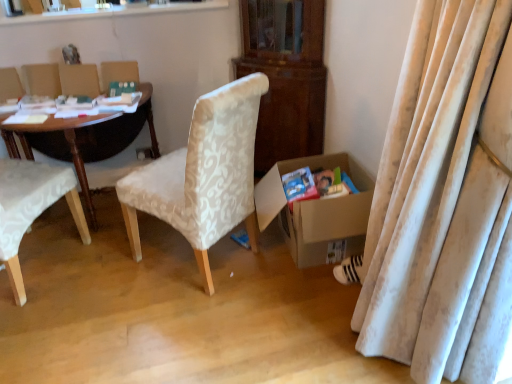
Describe the element at coordinates (348, 270) in the screenshot. I see `white striped fabric sneakers at lower right` at that location.

The image size is (512, 384). I want to click on white fabric chair at left, the 2th chair viewed from the right, so click(31, 208).

What is the approximate width of white fabric chair at left, which ranks as the 1th chair in left-to-right order?

It is 26.05 inches.

What do you see at coordinates (317, 184) in the screenshot? I see `matte cardboard magazine at lower right` at bounding box center [317, 184].

Measure the distance between point (328, 175) and camera.

The distance of point (328, 175) from camera is 7.43 feet.

Identify the location of green matte paperback book at upper left, placed as the 2th paperback book when sorted from right to left. (121, 88).

What do you see at coordinates (203, 174) in the screenshot?
I see `white textured fabric chair at center, which is the second chair in left-to-right order` at bounding box center [203, 174].

Find the location of a particular element. The image size is (512, 384). cardboard box at lower right is located at coordinates (317, 212).

Based on the photo, how different are the orientations of cardboard box at lower right and green matte paperback book at upper left, marked as the first paperback book in a left-to-right arrangement, in degrees?

The facing directions of cardboard box at lower right and green matte paperback book at upper left, marked as the first paperback book in a left-to-right arrangement, are 74.4 degrees apart.

From the image's perspective, would you say cardboard box at lower right is shown under green matte paperback book at upper left, which is the 2th paperback book in bottom-to-top order?

Yes, from the image's perspective, cardboard box at lower right is below green matte paperback book at upper left, which is the 2th paperback book in bottom-to-top order.

From a real-world perspective, is cardboard box at lower right located beneath green matte paperback book at upper left, marked as the first paperback book in a left-to-right arrangement?

Indeed, from a real-world perspective, cardboard box at lower right is positioned beneath green matte paperback book at upper left, marked as the first paperback book in a left-to-right arrangement.

How much distance is there between cardboard box at lower right and green matte paperback book at upper left, the second paperback book viewed from the front?

The distance of cardboard box at lower right from green matte paperback book at upper left, the second paperback book viewed from the front, is 3.84 feet.

Is white fabric chair at left, the 2th chair viewed from the right, oriented away from white striped fabric sneakers at lower right?

No, white fabric chair at left, the 2th chair viewed from the right, is not facing the opposite direction of white striped fabric sneakers at lower right.

Are white fabric chair at left, the 2th chair viewed from the right, and white striped fabric sneakers at lower right beside each other?

white fabric chair at left, the 2th chair viewed from the right, is not next to white striped fabric sneakers at lower right, and they're not touching.

Does white fabric chair at left, which ranks as the 1th chair in left-to-right order, have a smaller size compared to white striped fabric sneakers at lower right?

Actually, white fabric chair at left, which ranks as the 1th chair in left-to-right order, might be larger than white striped fabric sneakers at lower right.

Can you tell me how much white fabric chair at left, the 2th chair viewed from the right, and white striped fabric sneakers at lower right differ in facing direction?

The facing directions of white fabric chair at left, the 2th chair viewed from the right, and white striped fabric sneakers at lower right are 121 degrees apart.

Based on the photo, considering the relative positions of cardboard box at lower right and wooden polished desk at left in the image provided, is cardboard box at lower right to the right of wooden polished desk at left from the viewer's perspective?

Indeed, cardboard box at lower right is positioned on the right side of wooden polished desk at left.

From a real-world perspective, is cardboard box at lower right positioned above or below wooden polished desk at left?

From a real-world perspective, cardboard box at lower right is physically below wooden polished desk at left.

Is cardboard box at lower right shorter than wooden polished desk at left?

Correct, cardboard box at lower right is not as tall as wooden polished desk at left.

Would you consider cardboard box at lower right to be distant from wooden polished desk at left?

Absolutely, cardboard box at lower right is distant from wooden polished desk at left.

From the image's perspective, is white striped fabric sneakers at lower right above or below wooden polished desk at left?

Clearly, from the image's perspective, white striped fabric sneakers at lower right is below wooden polished desk at left.

From a real-world perspective, is white striped fabric sneakers at lower right positioned above or below wooden polished desk at left?

Clearly, from a real-world perspective, white striped fabric sneakers at lower right is below wooden polished desk at left.

Is white striped fabric sneakers at lower right behind wooden polished desk at left?

Yes, white striped fabric sneakers at lower right is further from the camera.

In terms of width, does white striped fabric sneakers at lower right look wider or thinner when compared to wooden polished desk at left?

white striped fabric sneakers at lower right is thinner than wooden polished desk at left.

Looking at this image, based on their sizes in the image, would you say white textured fabric chair at center, which is the second chair in left-to-right order, is bigger or smaller than green matte paperback book at upper left, marked as the first paperback book in a left-to-right arrangement?

Clearly, white textured fabric chair at center, which is the second chair in left-to-right order, is larger in size than green matte paperback book at upper left, marked as the first paperback book in a left-to-right arrangement.

Locate an element on the screen. The image size is (512, 384). chair that is the 1st one when counting forward from the green matte paperback book at upper left, the first paperback book from the back is located at coordinates (203, 174).

Is white textured fabric chair at center, the 1th chair in the right-to-left sequence, to the right of green matte paperback book at upper left, positioned as the first paperback book in top-to-bottom order, from the viewer's perspective?

Correct, you'll find white textured fabric chair at center, the 1th chair in the right-to-left sequence, to the right of green matte paperback book at upper left, positioned as the first paperback book in top-to-bottom order.

Between white textured fabric chair at center, the 1th chair in the right-to-left sequence, and green matte paperback book at upper left, the second paperback book viewed from the front, which one has more height?

Standing taller between the two is white textured fabric chair at center, the 1th chair in the right-to-left sequence.

Between green matte paperback book at upper left, positioned as the first paperback book in top-to-bottom order, and white fabric chair at left, which ranks as the 1th chair in left-to-right order, which one has smaller width?

green matte paperback book at upper left, positioned as the first paperback book in top-to-bottom order, is thinner.

I want to click on paperback book that is the 1st object to the right of the white fabric chair at left, which ranks as the 1th chair in left-to-right order, starting at the anchor, so click(121, 88).

Is green matte paperback book at upper left, the first paperback book from the back, taller than white fabric chair at left, which ranks as the 1th chair in left-to-right order?

No.

From the picture: Is white textured fabric chair at center, the 1th chair in the right-to-left sequence, looking in the opposite direction of cardboard box at lower right?

No, white textured fabric chair at center, the 1th chair in the right-to-left sequence, is not facing the opposite direction of cardboard box at lower right.

Which is behind, white textured fabric chair at center, the 1th chair in the right-to-left sequence, or cardboard box at lower right?

cardboard box at lower right.

Based on the photo, which object is positioned more to the left, white textured fabric chair at center, the 1th chair in the right-to-left sequence, or cardboard box at lower right?

From the viewer's perspective, white textured fabric chair at center, the 1th chair in the right-to-left sequence, appears more on the left side.

Consider the image. Is white textured fabric chair at center, which is the second chair in left-to-right order, located outside cardboard box at lower right?

Yes.

Locate an element on the screen. This screenshot has width=512, height=384. box below the green matte paperback book at upper left, placed as the 2th paperback book when sorted from right to left (from a real-world perspective) is located at coordinates (317, 212).

Where is `the 1st chair positioned above the white striped fabric sneakers at lower right (from the image's perspective)`? The width and height of the screenshot is (512, 384). the 1st chair positioned above the white striped fabric sneakers at lower right (from the image's perspective) is located at coordinates (31, 208).

Looking at the image, which one is located further to matte cardboard magazine at lower right, green matte paperback book at upper left, marked as the first paperback book in a left-to-right arrangement, or matte blue paperback book at lower right, positioned as the 1th paperback book in front-to-back order?

Among the two, green matte paperback book at upper left, marked as the first paperback book in a left-to-right arrangement, is located further to matte cardboard magazine at lower right.

Estimate the real-world distances between objects in this image. Which object is further from green matte paperback book at upper left, the first paperback book from the back, matte blue paperback book at lower right, the first paperback book in the bottom-to-top sequence, or white fabric chair at left, which ranks as the 1th chair in left-to-right order?

Among the two, matte blue paperback book at lower right, the first paperback book in the bottom-to-top sequence, is located further to green matte paperback book at upper left, the first paperback book from the back.

In the scene shown: From the image, which object appears to be farther from white striped fabric sneakers at lower right, white fabric chair at left, which ranks as the 1th chair in left-to-right order, or green matte paperback book at upper left, the first paperback book from the back?

white fabric chair at left, which ranks as the 1th chair in left-to-right order, lies further to white striped fabric sneakers at lower right than the other object.

Which object lies further to the anchor point matte cardboard magazine at lower right, white fabric chair at left, which ranks as the 1th chair in left-to-right order, or wooden polished desk at left?

wooden polished desk at left is positioned further to the anchor matte cardboard magazine at lower right.

When comparing their distances from white textured fabric chair at center, which is the second chair in left-to-right order, does white fabric chair at left, the 2th chair viewed from the right, or matte cardboard magazine at lower right seem closer?

matte cardboard magazine at lower right is positioned closer to the anchor white textured fabric chair at center, which is the second chair in left-to-right order.

Which object lies further to the anchor point white striped fabric sneakers at lower right, wooden polished desk at left or white textured fabric chair at center, which is the second chair in left-to-right order?

wooden polished desk at left lies further to white striped fabric sneakers at lower right than the other object.

Which object lies further to the anchor point green matte paperback book at upper left, the second paperback book viewed from the front, matte cardboard magazine at lower right or white striped fabric sneakers at lower right?

Among the two, white striped fabric sneakers at lower right is located further to green matte paperback book at upper left, the second paperback book viewed from the front.

From the image, which object appears to be farther from white textured fabric chair at center, the 1th chair in the right-to-left sequence, cardboard box at lower right or white striped fabric sneakers at lower right?

The object further to white textured fabric chair at center, the 1th chair in the right-to-left sequence, is white striped fabric sneakers at lower right.

Where is `box located between green matte paperback book at upper left, marked as the first paperback book in a left-to-right arrangement, and white striped fabric sneakers at lower right in the left-right direction`? The height and width of the screenshot is (384, 512). box located between green matte paperback book at upper left, marked as the first paperback book in a left-to-right arrangement, and white striped fabric sneakers at lower right in the left-right direction is located at coordinates (317, 212).

Locate an element on the screen. Image resolution: width=512 pixels, height=384 pixels. desk situated between white fabric chair at left, the 2th chair viewed from the right, and white striped fabric sneakers at lower right from left to right is located at coordinates (74, 144).

Locate an element on the screen. The height and width of the screenshot is (384, 512). chair situated between white fabric chair at left, the 2th chair viewed from the right, and matte cardboard magazine at lower right from left to right is located at coordinates (203, 174).

You are a GUI agent. You are given a task and a screenshot of the screen. Output one action in this format:
    pyautogui.click(x=<x>, y=<y>)
    Task: Click on the paperback book situated between green matte paperback book at upper left, which is the 2th paperback book in bottom-to-top order, and cardboard box at lower right from left to right
    The height and width of the screenshot is (384, 512).
    Given the screenshot: What is the action you would take?
    pyautogui.click(x=298, y=186)